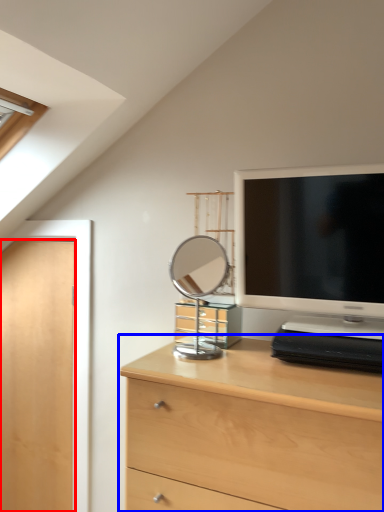
Question: Among these objects, which one is farthest to the camera, door (highlighted by a red box) or chest of drawers (highlighted by a blue box)?

Choices:
 (A) door
 (B) chest of drawers

Answer: (A)